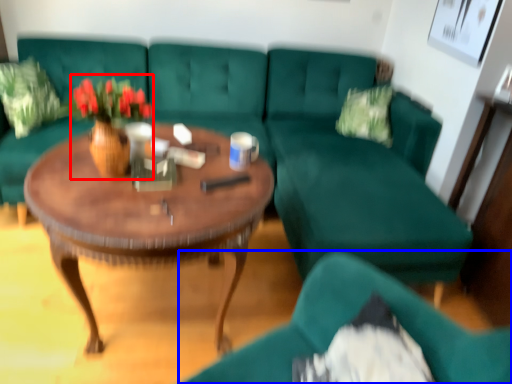
Question: Among these objects, which one is nearest to the camera, floral arrangement (highlighted by a red box) or chair (highlighted by a blue box)?

Choices:
 (A) floral arrangement
 (B) chair

Answer: (B)